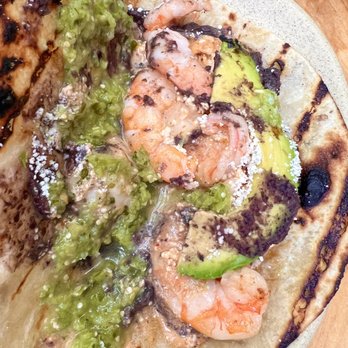
Where is `speckled table top`? The width and height of the screenshot is (348, 348). speckled table top is located at coordinates (288, 29).